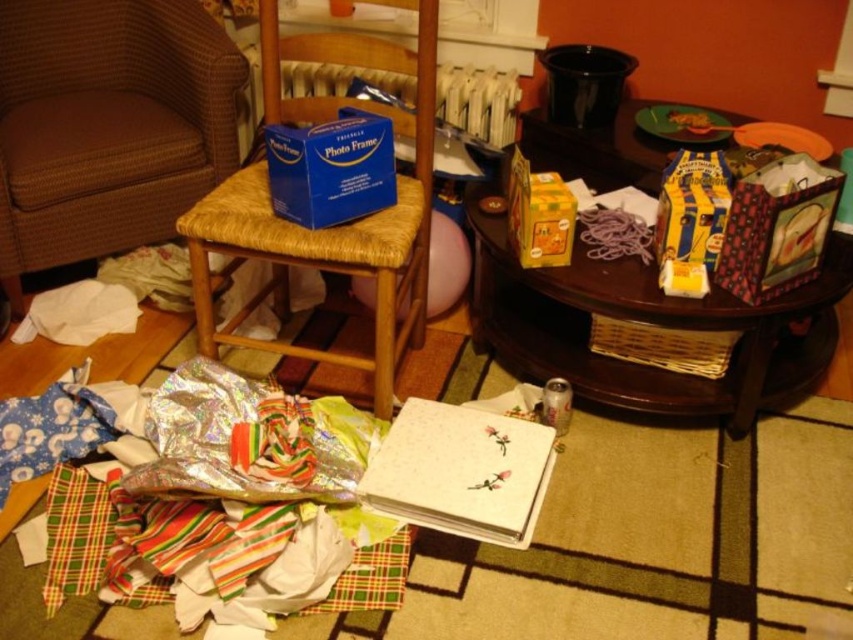
Question: Which of these objects is positioned farthest from the yellow cardboard box at center?

Choices:
 (A) brown woven armchair at left
 (B) woodenside table at right
 (C) brown woven chair at left
 (D) blue cardboard photo frame at center

Answer: (A)

Question: Which point appears closest to the camera in this image?

Choices:
 (A) (822, 275)
 (B) (236, 209)
 (C) (135, 150)
 (D) (567, 244)

Answer: (B)

Question: Is blue cardboard photo frame at center below yellow cardboard box at center?

Choices:
 (A) no
 (B) yes

Answer: (A)

Question: Is woodenside table at right positioned in front of blue cardboard photo frame at center?

Choices:
 (A) no
 (B) yes

Answer: (A)

Question: Does woodenside table at right appear over yellow cardboard box at center?

Choices:
 (A) no
 (B) yes

Answer: (A)

Question: Which object is farther from the camera taking this photo?

Choices:
 (A) woodenside table at right
 (B) brown woven armchair at left
 (C) blue cardboard photo frame at center
 (D) yellow cardboard box at center

Answer: (B)